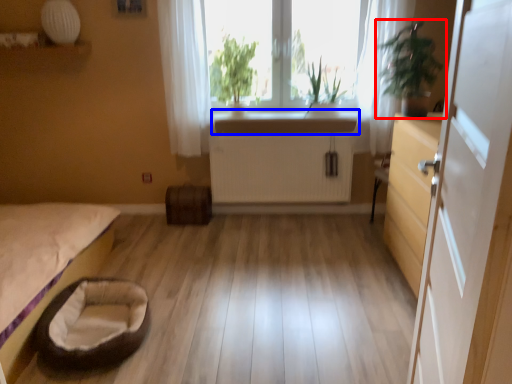
Question: Which of the following is the farthest to the observer, houseplant (highlighted by a red box) or counter top (highlighted by a blue box)?

Choices:
 (A) houseplant
 (B) counter top

Answer: (B)